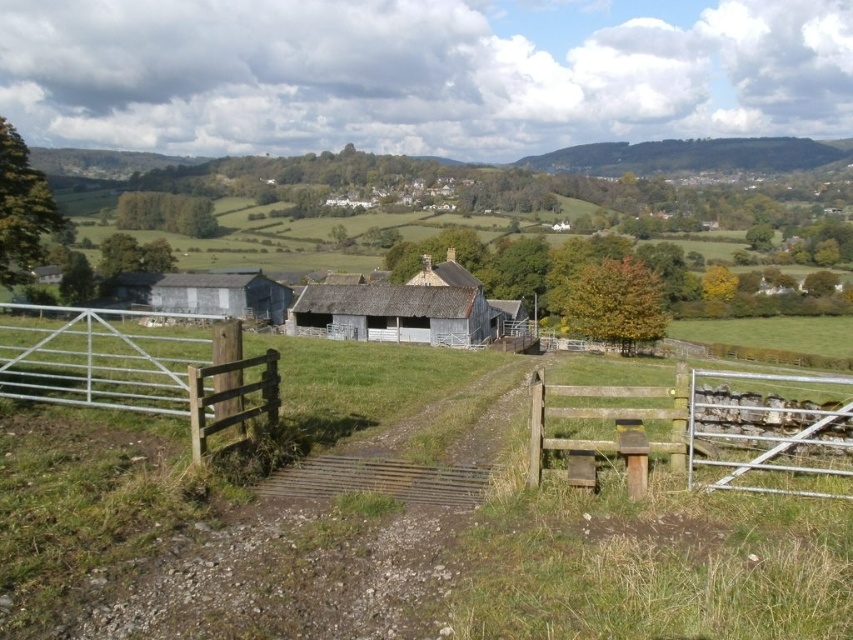
You are a farmer standing at the entrance of the metal gate with wooden posts. You need to walk to the brown wooden fence at lower right and then to the weathered wood barn at center. Which direction should you go first from the gate?

The brown wooden fence at lower right is positioned under the weathered wood barn at center, so you should first go to the brown wooden fence at lower right before heading to the barn.

You are a farmer planning to mow the green grassy at center. Considering the height of the weathered wood barn at center, will the grass need to be mowed before the barn requires maintenance?

The green grassy at center is not as tall as the weathered wood barn at center, so the grass is shorter. Therefore, the grass does not need immediate mowing before the barn requires maintenance.

You are a farmer who needs to cross from the metallic silver gate at left to the green grassy at center. Your tractor has a turning radius of 2.5 meters. Can your tractor make the turn from the gate to the grassy area without any issues?

The distance between the metallic silver gate at left and green grassy at center is 3.00 meters. Since the tractor has a turning radius of 2.5 meters, which is less than the available space, the tractor can make the turn without any issues.